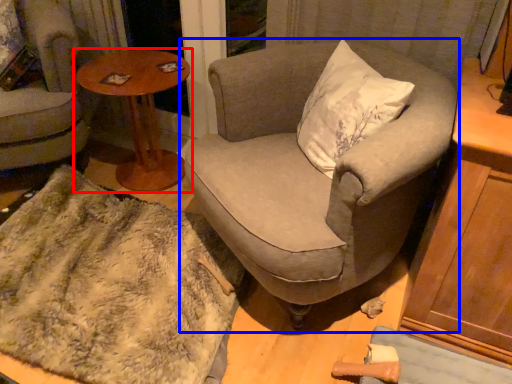
Question: Among these objects, which one is farthest to the camera, table (highlighted by a red box) or chair (highlighted by a blue box)?

Choices:
 (A) table
 (B) chair

Answer: (A)